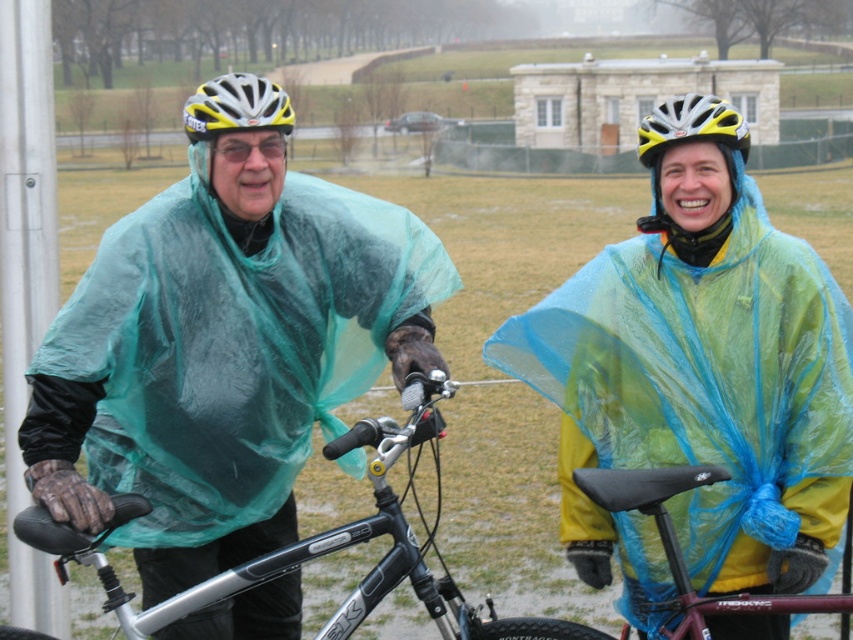
From the picture: Between translucent blue poncho at center and silver metallic bicycle at center, which one is positioned lower?

silver metallic bicycle at center is below.

Is point (786, 618) more distant than point (294, 552)?

That is True.

Which is behind, point (804, 376) or point (430, 408)?

Point (804, 376)

The image size is (853, 640). I want to click on translucent blue poncho at center, so click(x=698, y=388).

Can you confirm if yellow matte helmet at upper left is positioned to the right of black seat at center?

No, yellow matte helmet at upper left is not to the right of black seat at center.

Does yellow matte helmet at upper left have a smaller size compared to black seat at center?

Actually, yellow matte helmet at upper left might be larger than black seat at center.

At what (x,y) coordinates should I click in order to perform the action: click on yellow matte helmet at upper left. Please return your answer as a coordinate pair (x, y). Image resolution: width=853 pixels, height=640 pixels. Looking at the image, I should click on [241, 140].

Can you confirm if black seat at center is smaller than yellow and white matte bicycle helmet at upper center?

Yes.

Who is shorter, black seat at center or yellow and white matte bicycle helmet at upper center?

black seat at center

Which is behind, point (583, 484) or point (231, 93)?

Point (231, 93)

Locate an element on the screen. Image resolution: width=853 pixels, height=640 pixels. black seat at center is located at coordinates (680, 548).